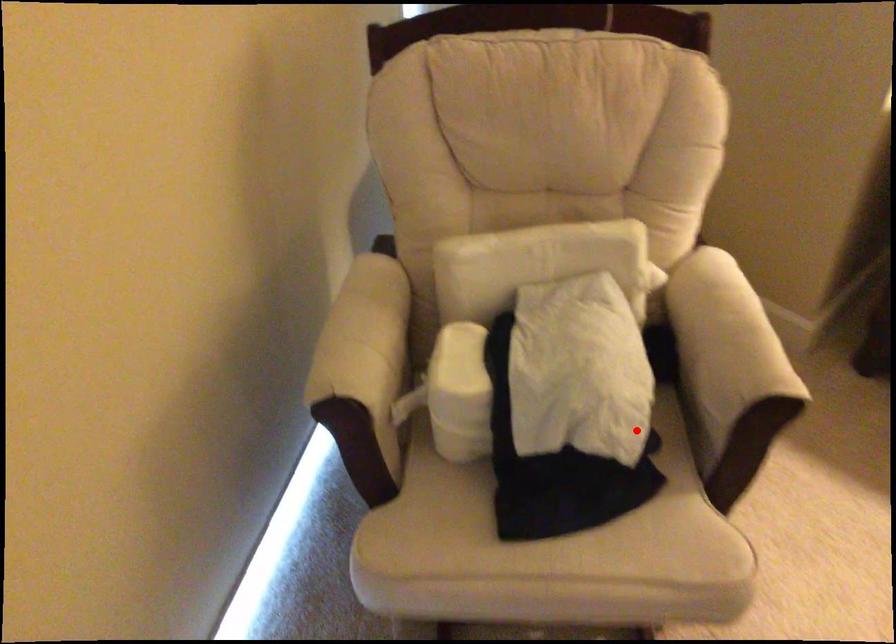
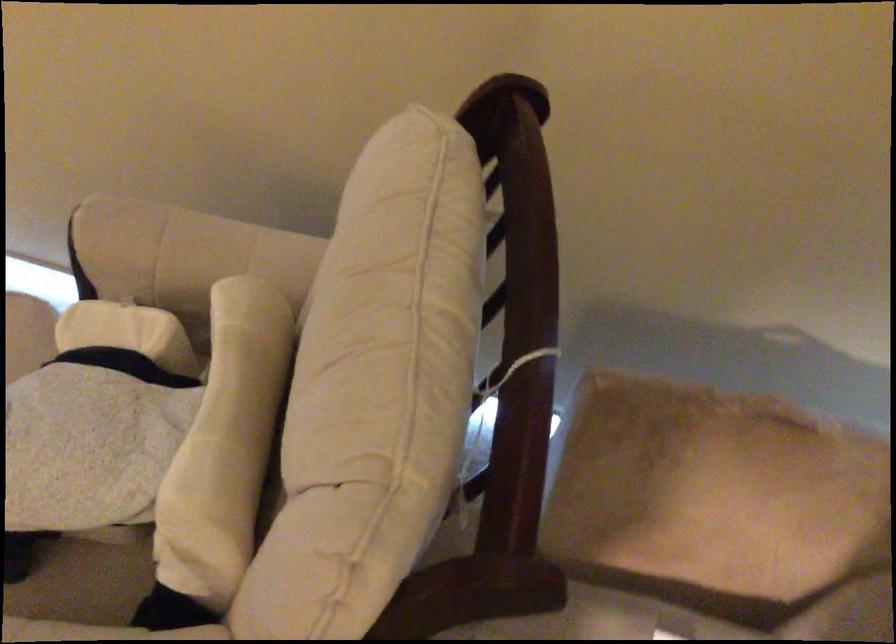
Question: A red point is marked in image1. In image2, is the corresponding 3D point closer to the camera or farther? Reply with the corresponding letter.

Choices:
 (A) The corresponding 3D point is closer.
 (B) The corresponding 3D point is farther.

Answer: (A)